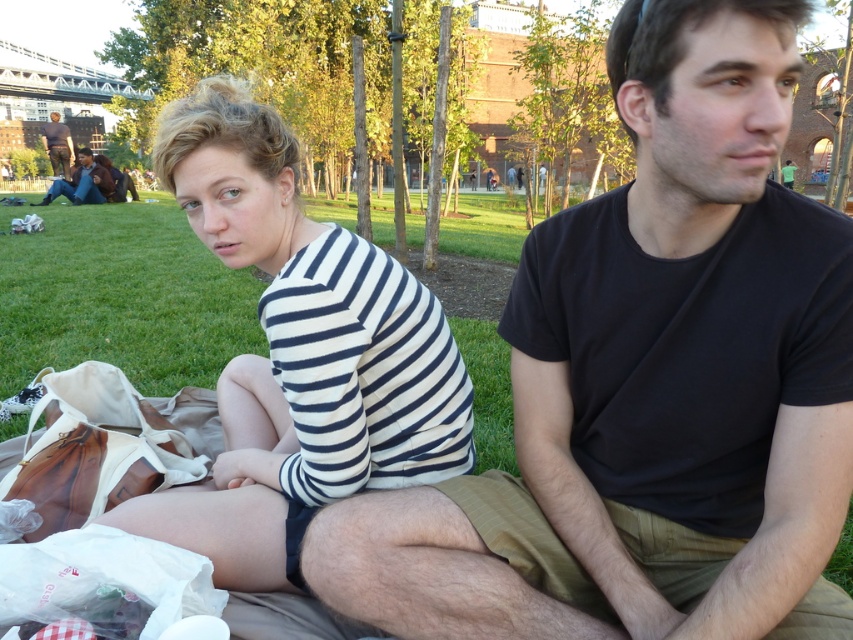
Who is lower down, black cotton t-shirt at center or dark brown leather jacket at upper left?

black cotton t-shirt at center is lower down.

Can you confirm if black cotton t-shirt at center is smaller than dark brown leather jacket at upper left?

Yes, black cotton t-shirt at center is smaller than dark brown leather jacket at upper left.

Who is more distant from viewer, (773, 253) or (64, 125)?

The point (64, 125) is more distant.

I want to click on black cotton t-shirt at center, so 643,390.

Does black cotton t-shirt at center appear on the left side of white striped shirt at center?

In fact, black cotton t-shirt at center is to the right of white striped shirt at center.

Which is behind, point (315, 538) or point (270, 481)?

The point (270, 481) is behind.

What do you see at coordinates (643, 390) in the screenshot? The height and width of the screenshot is (640, 853). I see `black cotton t-shirt at center` at bounding box center [643, 390].

At what (x,y) coordinates should I click in order to perform the action: click on black cotton t-shirt at center. Please return your answer as a coordinate pair (x, y). Looking at the image, I should click on (643, 390).

Does white striped shirt at center have a larger size compared to brown leather jacket at lower left?

No, white striped shirt at center is not bigger than brown leather jacket at lower left.

Between white striped shirt at center and brown leather jacket at lower left, which one appears on the right side from the viewer's perspective?

Positioned to the right is white striped shirt at center.

Between point (260, 442) and point (97, 198), which one is positioned in front?

Point (260, 442) is in front.

I want to click on white striped shirt at center, so click(299, 355).